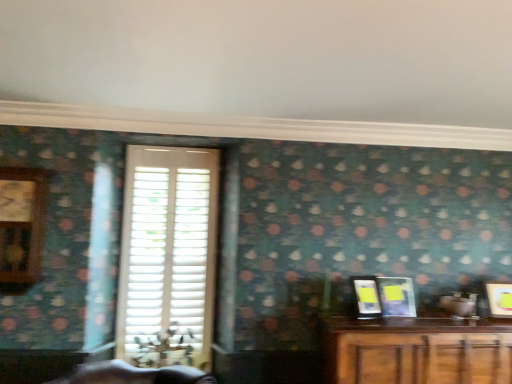
Question: Could you tell me if matte black picture frame at right, which is counted as the 3th picture frame, starting from the right, is facing wooden clock at left?

Choices:
 (A) no
 (B) yes

Answer: (A)

Question: Is matte black picture frame at right, arranged as the first picture frame when viewed from the left, positioned before wooden clock at left?

Choices:
 (A) no
 (B) yes

Answer: (A)

Question: Are matte black picture frame at right, which is counted as the 3th picture frame, starting from the right, and wooden clock at left far apart?

Choices:
 (A) no
 (B) yes

Answer: (B)

Question: Does matte black picture frame at right, arranged as the first picture frame when viewed from the left, have a lesser width compared to wooden clock at left?

Choices:
 (A) yes
 (B) no

Answer: (A)

Question: Can you confirm if matte black picture frame at right, which is counted as the 3th picture frame, starting from the right, is taller than wooden clock at left?

Choices:
 (A) no
 (B) yes

Answer: (A)

Question: Does matte black picture frame at right, which is counted as the 3th picture frame, starting from the right, have a greater width compared to wooden clock at left?

Choices:
 (A) yes
 (B) no

Answer: (B)

Question: Does matte yellow picture frame at right, marked as the 1th picture frame in a right-to-left arrangement, have a larger size compared to wooden clock at left?

Choices:
 (A) yes
 (B) no

Answer: (B)

Question: Considering the relative positions of matte yellow picture frame at right, which ranks as the 3th picture frame in left-to-right order, and wooden clock at left in the image provided, is matte yellow picture frame at right, which ranks as the 3th picture frame in left-to-right order, to the right of wooden clock at left from the viewer's perspective?

Choices:
 (A) yes
 (B) no

Answer: (A)

Question: Would you say matte yellow picture frame at right, marked as the 1th picture frame in a right-to-left arrangement, is outside wooden clock at left?

Choices:
 (A) yes
 (B) no

Answer: (A)

Question: Considering the relative sizes of matte yellow picture frame at right, which ranks as the 3th picture frame in left-to-right order, and wooden clock at left in the image provided, is matte yellow picture frame at right, which ranks as the 3th picture frame in left-to-right order, smaller than wooden clock at left?

Choices:
 (A) no
 (B) yes

Answer: (B)

Question: Is there a large distance between matte yellow picture frame at right, marked as the 1th picture frame in a right-to-left arrangement, and wooden clock at left?

Choices:
 (A) no
 (B) yes

Answer: (B)

Question: From the image's perspective, is matte yellow picture frame at right, marked as the 1th picture frame in a right-to-left arrangement, located above wooden clock at left?

Choices:
 (A) yes
 (B) no

Answer: (B)

Question: From a real-world perspective, is wooden clock at left below matte yellow picture frame at right, which ranks as the 3th picture frame in left-to-right order?

Choices:
 (A) no
 (B) yes

Answer: (A)